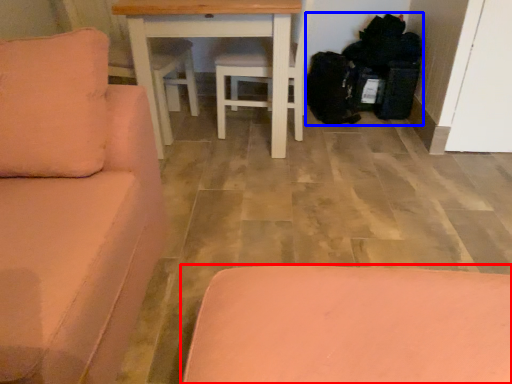
Question: Which point is closer to the camera, furniture (highlighted by a red box) or garbage (highlighted by a blue box)?

Choices:
 (A) furniture
 (B) garbage

Answer: (A)